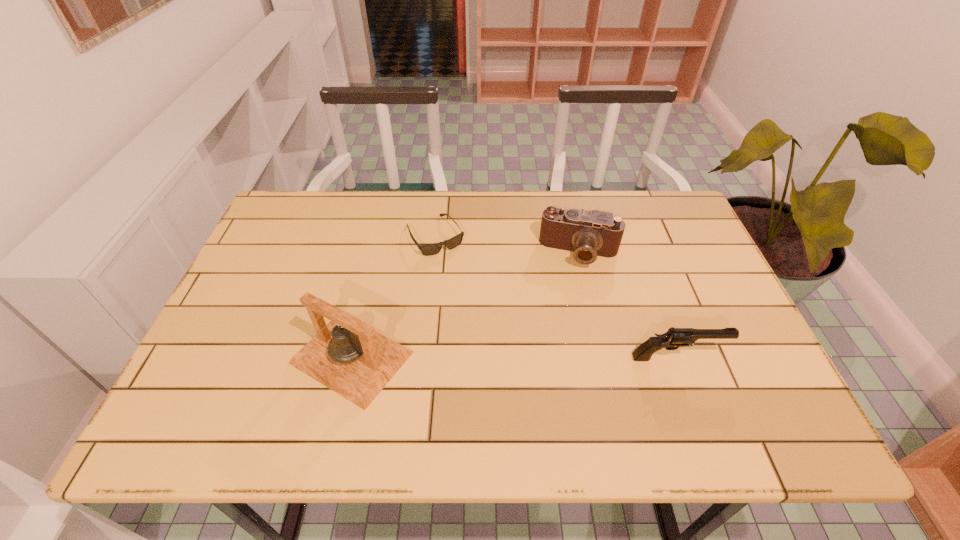
Identify the location of free location located on the front-facing side of the camera. (554, 387).

Where is `sunglasses that is at the far edge`? Image resolution: width=960 pixels, height=540 pixels. sunglasses that is at the far edge is located at coordinates (430, 249).

Find the location of a particular element. This screenshot has height=540, width=960. camera that is at the far edge is located at coordinates point(588,234).

Where is `object that is at the near edge`? object that is at the near edge is located at coordinates (347, 355).

The width and height of the screenshot is (960, 540). I want to click on object situated at the right edge, so click(674, 338).

In the image, there is a desktop. Identify the location of vacant space at the far edge. Image resolution: width=960 pixels, height=540 pixels. (454, 221).

I want to click on vacant space at the left edge of the desktop, so click(279, 241).

This screenshot has width=960, height=540. In the image, there is a desktop. What are the coordinates of `blank space at the right edge` in the screenshot? It's located at (705, 318).

In the image, there is a desktop. Identify the location of vacant area at the far left corner. This screenshot has height=540, width=960. (306, 210).

Identify the location of vacant space at the near right corner of the desktop. (751, 372).